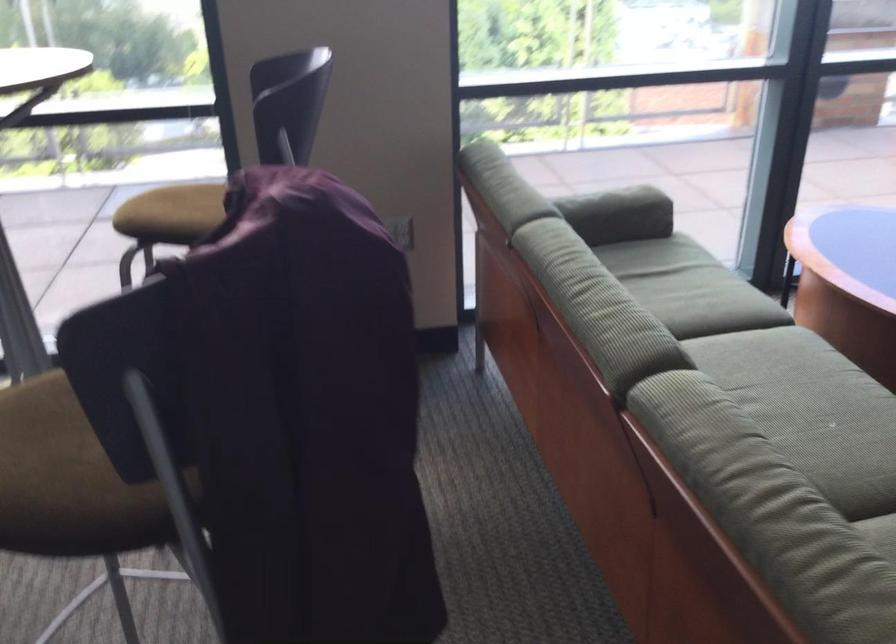
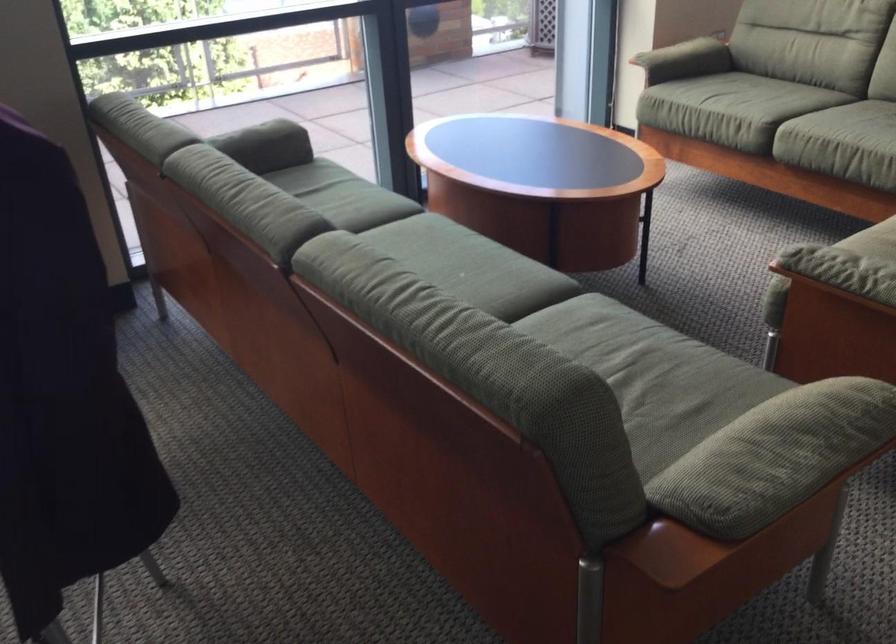
In the second image, find the point that corresponds to point (618, 201) in the first image.

(265, 140)